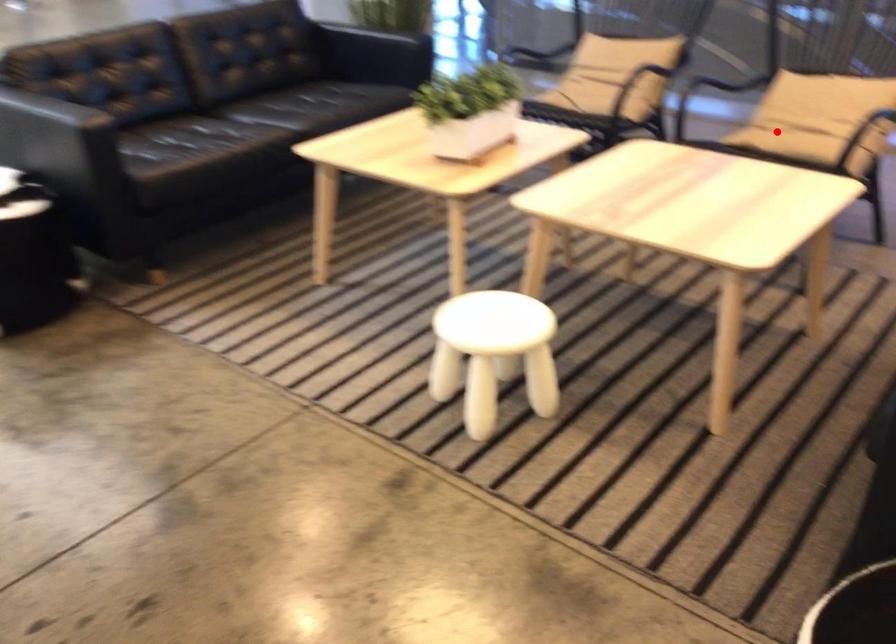
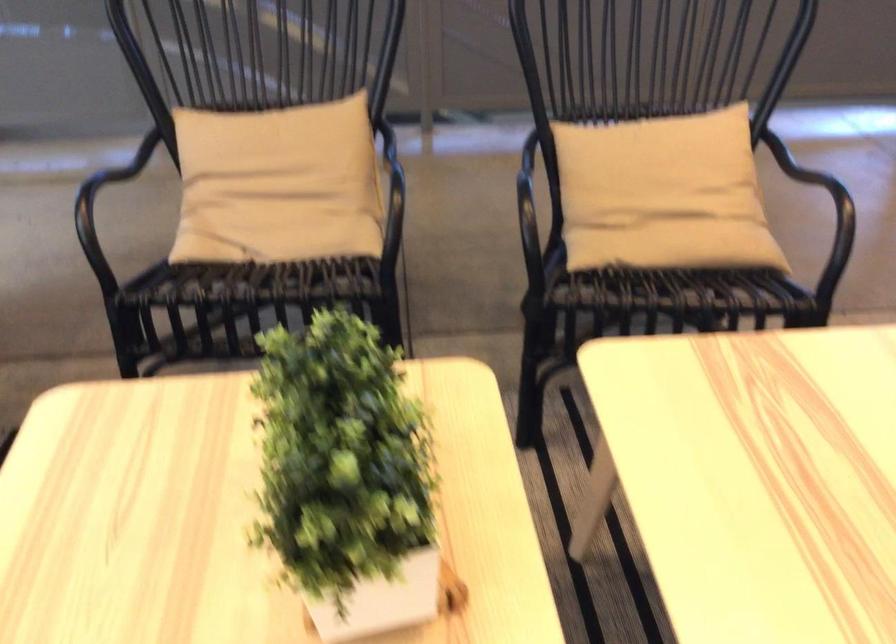
The point at the highlighted location is marked in the first image. Where is the corresponding point in the second image?

(674, 245)